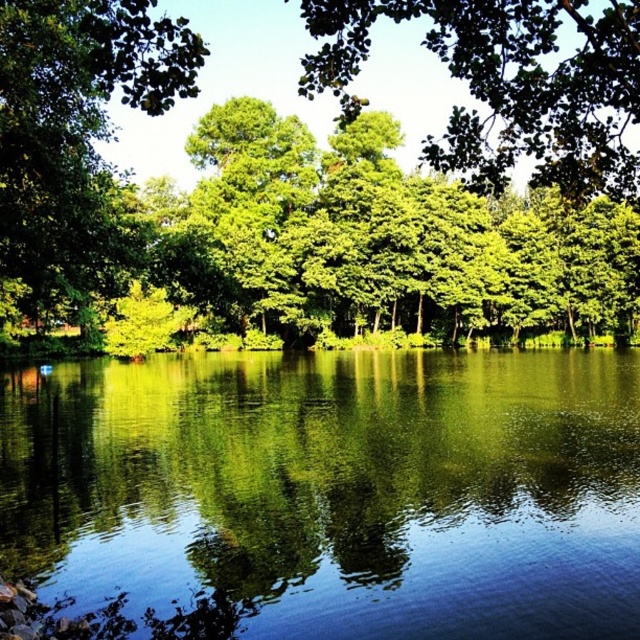
Can you confirm if green leafy tree at center is positioned to the right of green reflective water at center?

No, green leafy tree at center is not to the right of green reflective water at center.

Does point (29, 52) come farther from viewer compared to point (429, 419)?

No, it is not.

Which is in front, point (1, 186) or point (541, 436)?

Point (1, 186) is more forward.

Find the location of a particular element. green leafy tree at center is located at coordinates (330, 176).

Is point (586, 38) farther from camera compared to point (36, 260)?

Yes, point (586, 38) is farther from viewer.

Is point (141, 202) closer to camera compared to point (116, 195)?

No, (141, 202) is further to viewer.

The image size is (640, 640). What are the coordinates of `green leafy tree at center` in the screenshot? It's located at point(330,176).

Which is above, green reflective water at center or green leafy tree at left?

green leafy tree at left is higher up.

Does point (435, 426) come behind point (189, 86)?

Yes, it is.

You are a GUI agent. You are given a task and a screenshot of the screen. Output one action in this format:
    pyautogui.click(x=<x>, y=<y>)
    Task: Click on the green reflective water at center
    The height and width of the screenshot is (640, 640).
    Given the screenshot: What is the action you would take?
    pyautogui.click(x=333, y=490)

At what (x,y) coordinates should I click in order to perform the action: click on green reflective water at center. Please return your answer as a coordinate pair (x, y). The width and height of the screenshot is (640, 640). Looking at the image, I should click on (333, 490).